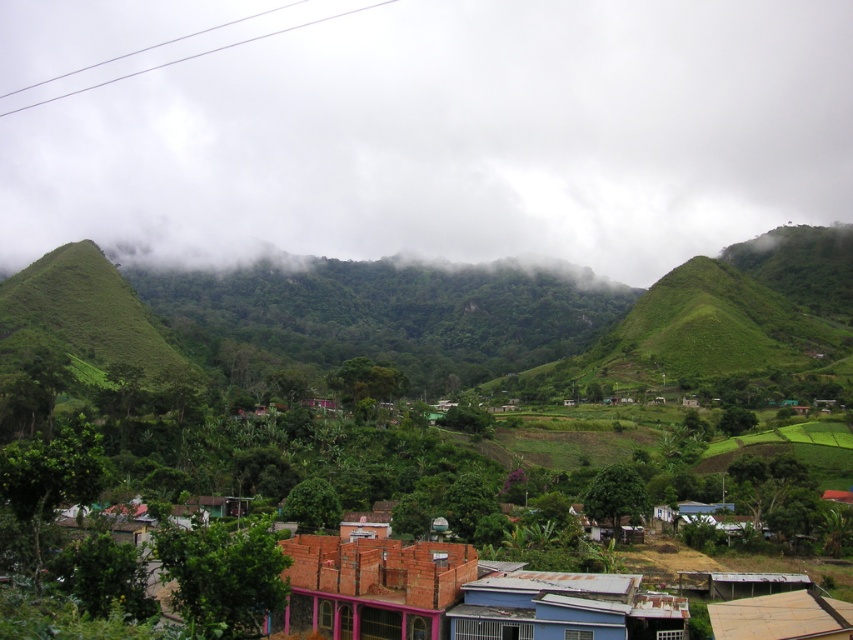
You are a hiker planning to take a photo of the green leafy hillside at upper center and the brown wooden hut at lower right. Which object should you focus on first if you want to capture both in a single frame without moving your camera?

You should focus on the green leafy hillside at upper center first because it is larger than the brown wooden hut at lower right, making it more prominent in the frame.

From the picture: You are planning to build a new garden shed next to the brick house at center and the green leafy hillside at left. Given their sizes, which structure would require more space for the shed to be placed beside it?

The green leafy hillside at left requires more space because it has a greater width than the brick house at center, so the shed would need to be placed further away from it to accommodate its size.

You are a drone operator tasked with capturing aerial footage of the brick house at center and the green leafy hillside at left. Based on the scene description, which object is located to the right of the other?

The brick house at center is positioned on the right side of green leafy hillside at left, so the brick house at center is to the right of the green leafy hillside at left.